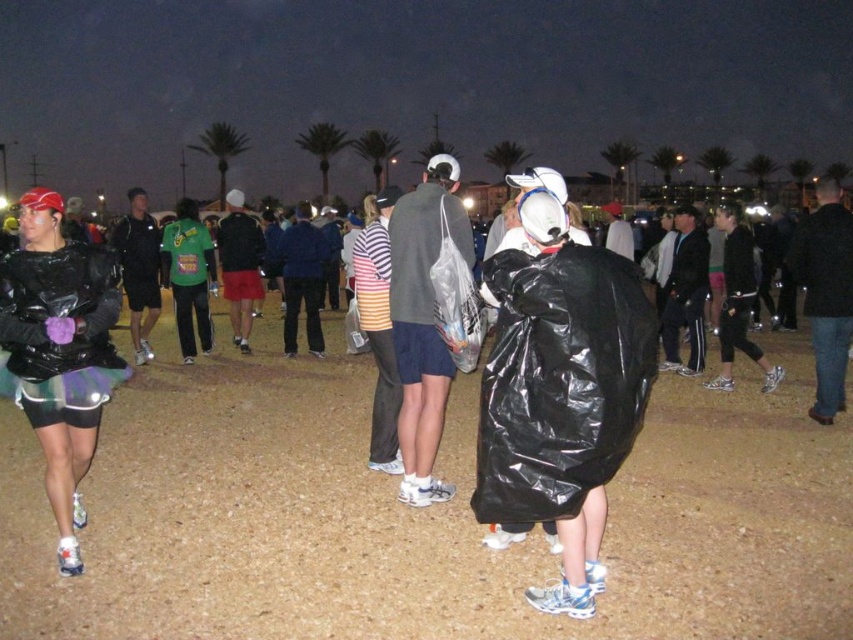
Can you confirm if black plastic bag at center is shorter than matte gray jacket at center?

No.

Who is shorter, black plastic bag at center or matte gray jacket at center?

Standing shorter between the two is matte gray jacket at center.

Describe the element at coordinates (561, 392) in the screenshot. The image size is (853, 640). I see `black plastic bag at center` at that location.

Identify the location of black plastic bag at center. (561, 392).

In the scene shown: Who is positioned more to the right, matte black jacket at left or matte gray jacket at center?

From the viewer's perspective, matte gray jacket at center appears more on the right side.

The height and width of the screenshot is (640, 853). I want to click on matte black jacket at left, so click(59, 352).

Is black plastic bag at center to the left of matte black jacket at left from the viewer's perspective?

No, black plastic bag at center is not to the left of matte black jacket at left.

Describe the element at coordinates (561, 392) in the screenshot. I see `black plastic bag at center` at that location.

Who is more distant from viewer, (596, 314) or (80, 502)?

The point (80, 502) is more distant.

You are a GUI agent. You are given a task and a screenshot of the screen. Output one action in this format:
    pyautogui.click(x=<x>, y=<y>)
    Task: Click on the black plastic bag at center
    This screenshot has height=640, width=853.
    Given the screenshot: What is the action you would take?
    pyautogui.click(x=561, y=392)